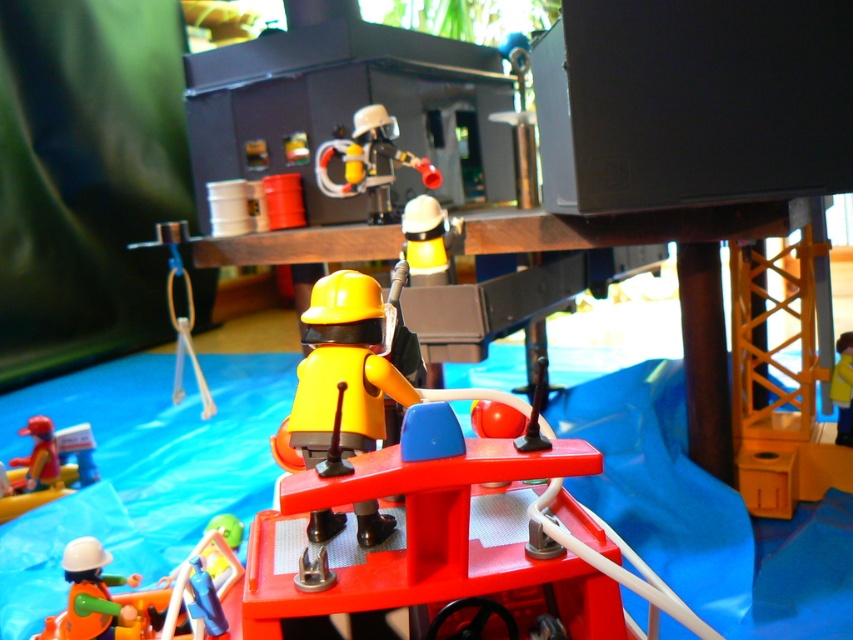
You are a worker at the construction site shown in the image. You need to retrieve a tool from the yellow matte helmet at upper center. The yellow plastic ladder at center is your only access point. Can you reach the helmet from the ladder?

The yellow matte helmet at upper center is above the yellow plastic ladder at center, so you cannot reach the helmet from the ladder since it is positioned higher than the ladder can access.

You are a construction worker in the scene and need to locate both the matte yellow helmet at center and the matte red helmet at lower left. Which helmet is located to the right of the other?

The matte yellow helmet at center is positioned on the right side of the matte red helmet at lower left, so the matte yellow helmet at center is to the right of the matte red helmet at lower left.

You are a drone operator trying to navigate between two points in the miniature construction scene. The first point is at coordinates point (415, 196) and the second is at point (849, 397). Which point is closer to the camera?

Point (415, 196) is further to the camera than point (849, 397). Therefore, the point closer to the camera is point (849, 397).